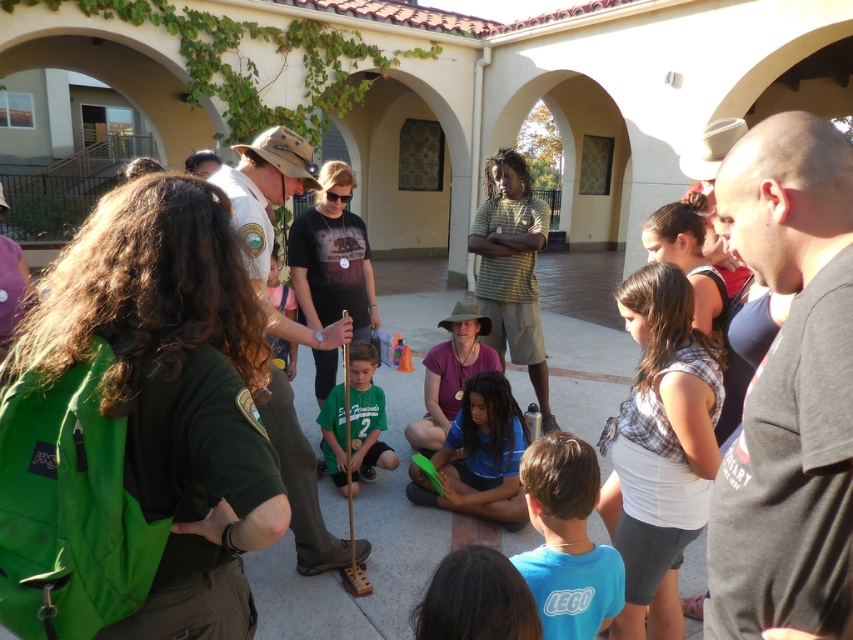
Question: Is the position of khaki canvas hat at center more distant than that of blue fabric at center?

Choices:
 (A) yes
 (B) no

Answer: (B)

Question: Which object is the farthest from the green matte shirt at center?

Choices:
 (A) matte purple shirt at center
 (B) green striped shirt at center
 (C) blue fabric at center

Answer: (B)

Question: Which point is closer to the camera taking this photo?

Choices:
 (A) (497, 369)
 (B) (566, 468)

Answer: (B)

Question: Does blue cotton shirt at lower center have a greater width compared to green striped shirt at center?

Choices:
 (A) no
 (B) yes

Answer: (A)

Question: Which of the following is the closest to the observer?

Choices:
 (A) blue fabric at center
 (B) green matte shirt at center
 (C) dark gray t-shirt at right

Answer: (C)

Question: Is plaid fabric shirt at center behind matte purple shirt at center?

Choices:
 (A) no
 (B) yes

Answer: (A)